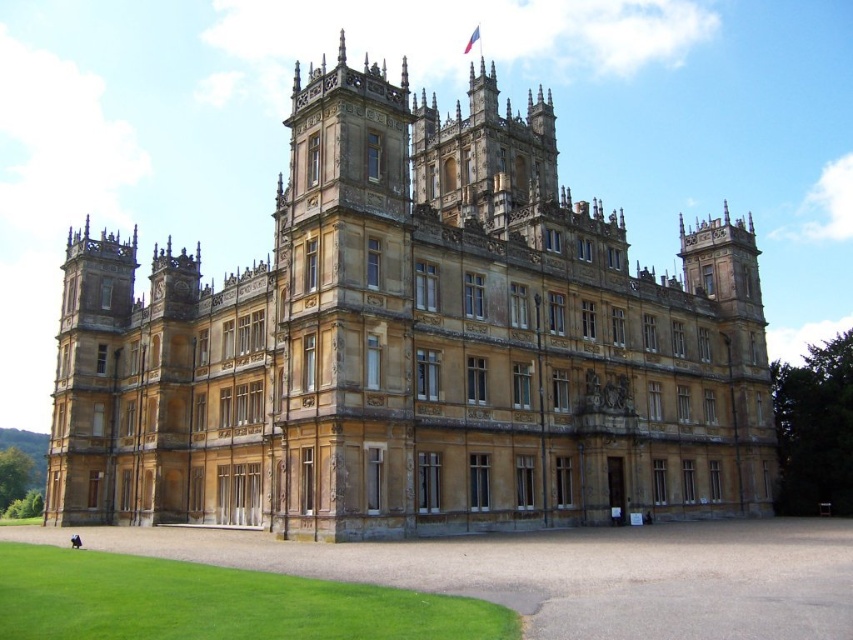
You are standing in front of the golden stone castle at center and looking towards the green grass at lower left. Which object is closer to you?

The golden stone castle at center is closer to you than the green grass at lower left because it is positioned further away from the viewer.

Looking at this image, you are standing in a field and see the golden stone castle at center and the green grass at lower left. Which object is positioned to the right of the other?

The golden stone castle at center is positioned to the right of green grass at lower left.